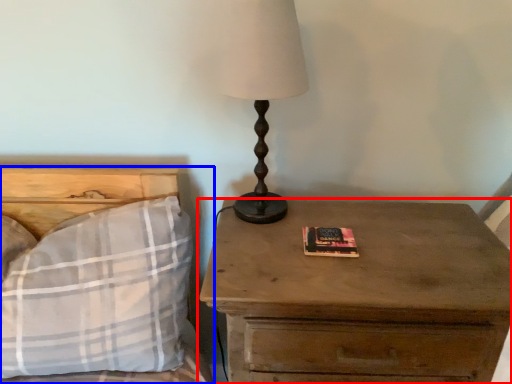
Question: Which object is further to the camera taking this photo, nightstand (highlighted by a red box) or bed (highlighted by a blue box)?

Choices:
 (A) nightstand
 (B) bed

Answer: (B)